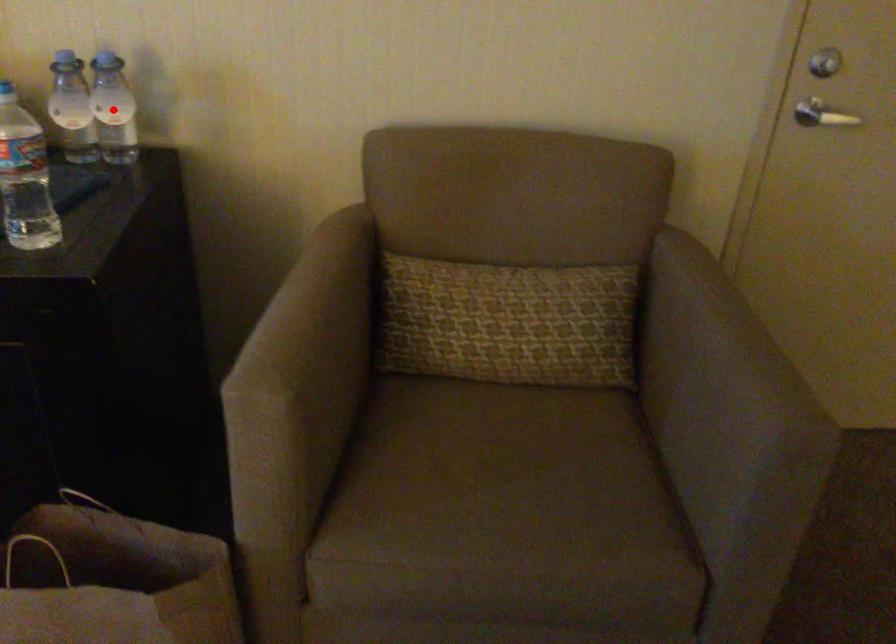
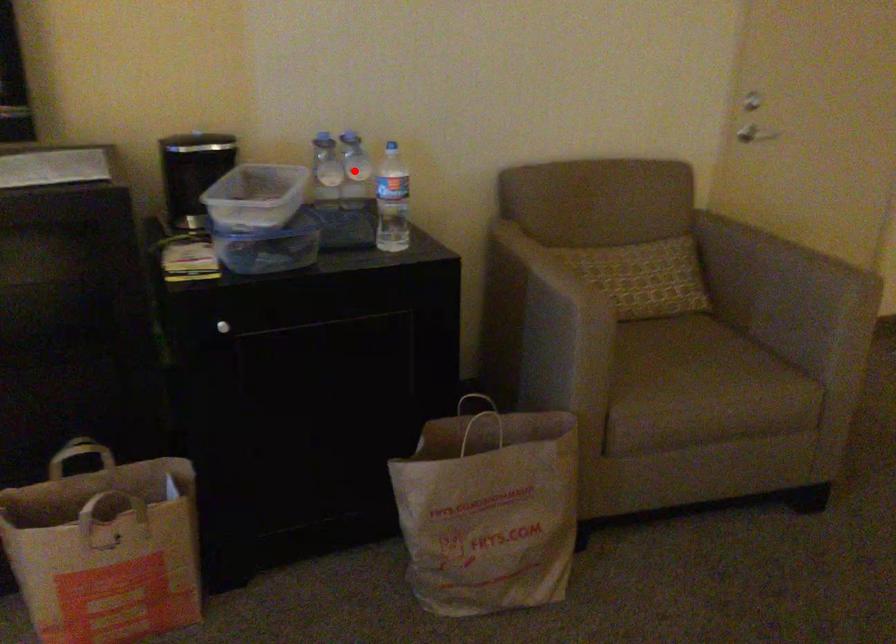
I am providing you with two images of the same scene from different viewpoints. A red point is marked on the first image and another point is marked on the second image. Is the marked point in image1 the same physical position as the marked point in image2?

Yes